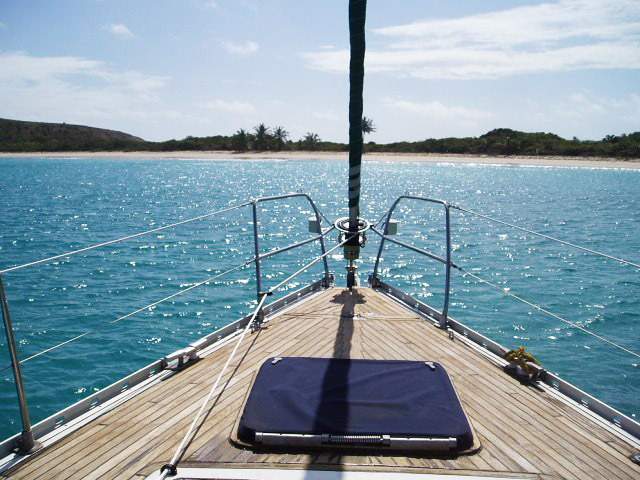
This screenshot has height=480, width=640. Find the location of `navy blue door closed`. navy blue door closed is located at coordinates (378, 398).